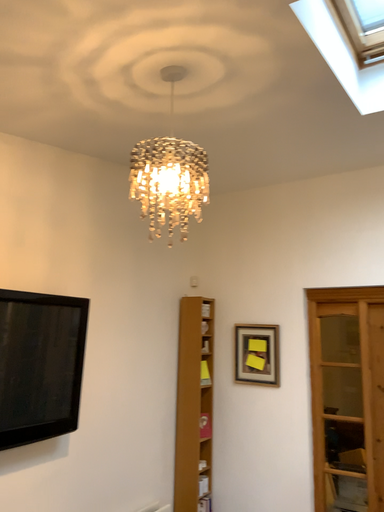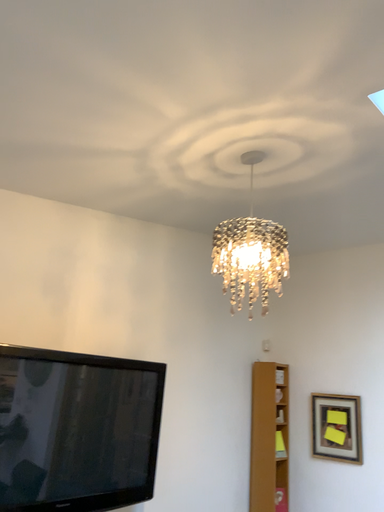
Question: How did the camera likely rotate when shooting the video?

Choices:
 (A) rotated right
 (B) rotated left

Answer: (B)